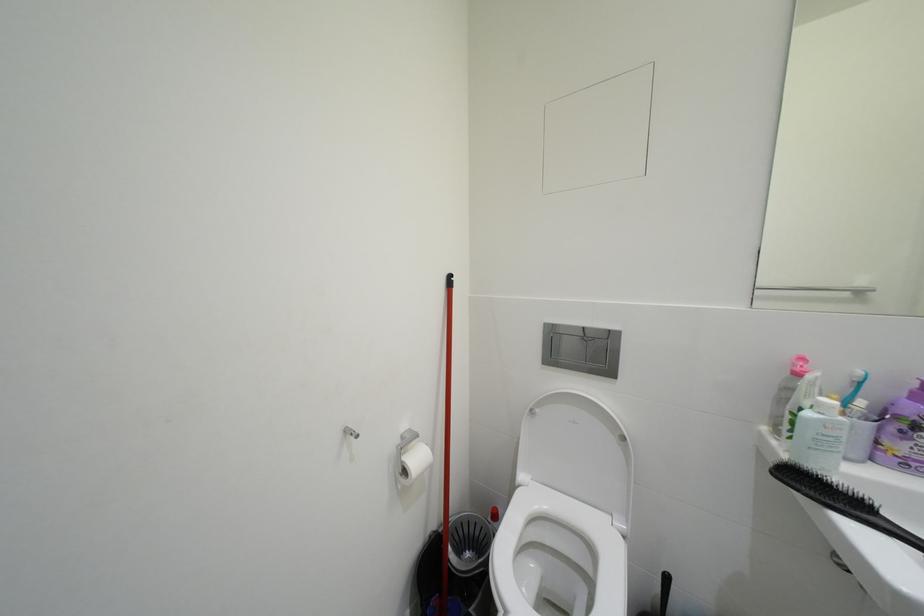
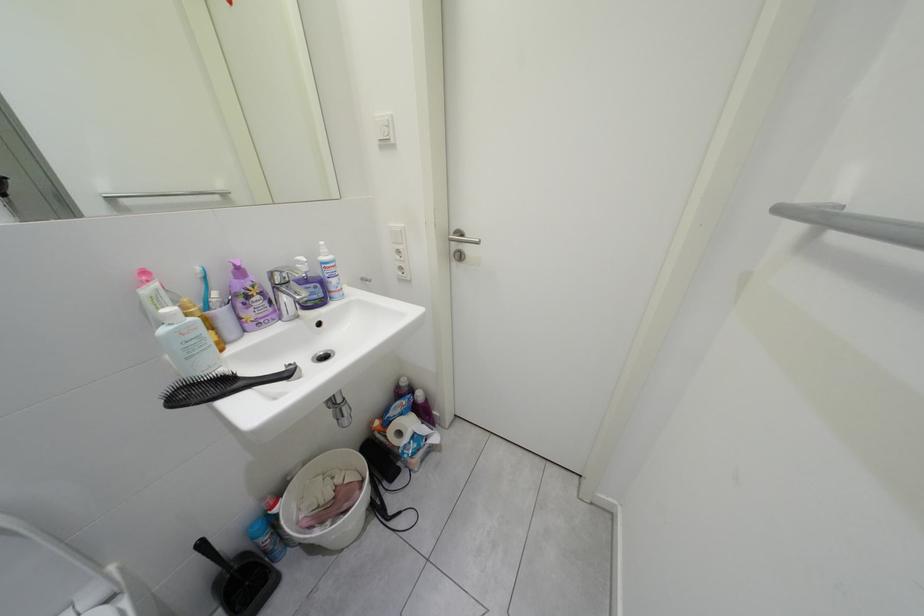
Looking at this image, the images are taken continuously from a first-person perspective. In which direction is your viewpoint rotating?

The camera rotated toward right-down.